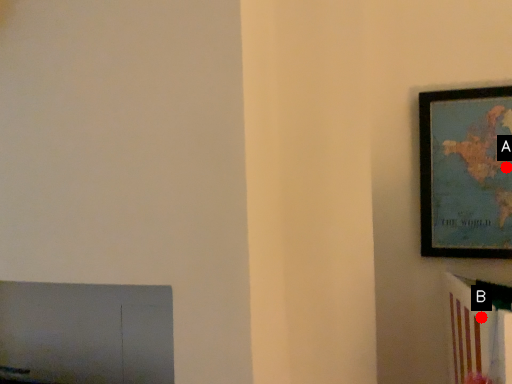
Question: Two points are circled on the image, labeled by A and B beside each circle. Which point is closer to the camera?

Choices:
 (A) A is closer
 (B) B is closer

Answer: (B)